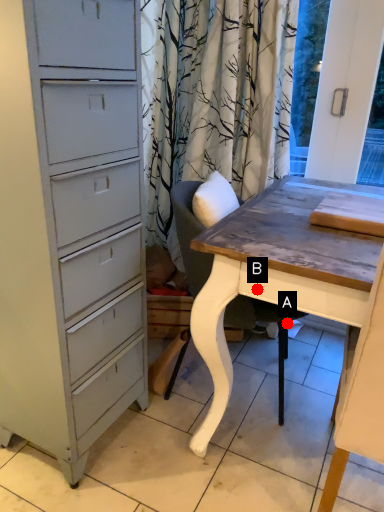
Question: Two points are circled on the image, labeled by A and B beside each circle. Which of the following is the closest to the observer?

Choices:
 (A) A is closer
 (B) B is closer

Answer: (B)